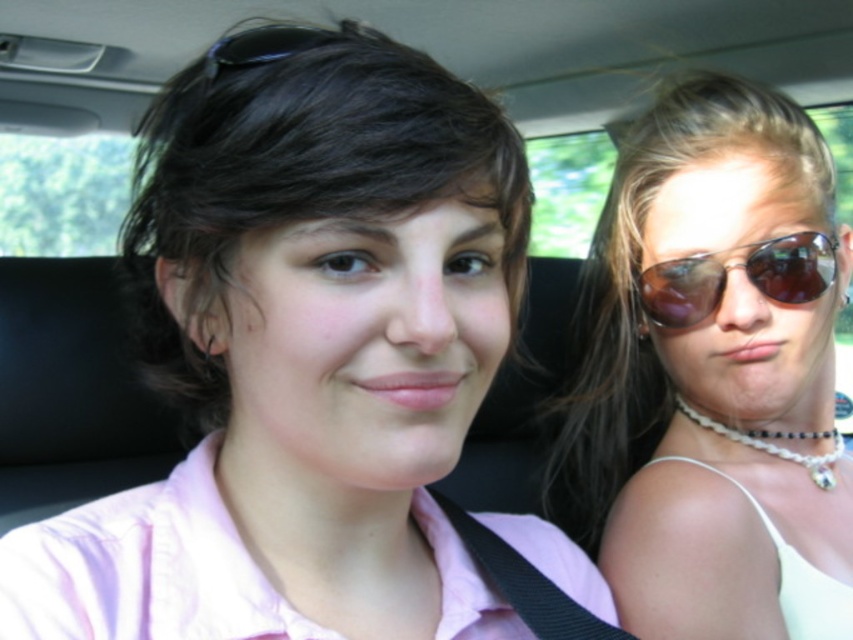
Which is above, sunglasses at right or brown reflective sunglasses at right?

brown reflective sunglasses at right

From the picture: Is sunglasses at right smaller than brown reflective sunglasses at right?

No.

The width and height of the screenshot is (853, 640). Describe the element at coordinates (709, 365) in the screenshot. I see `sunglasses at right` at that location.

Where is `sunglasses at right`? The image size is (853, 640). sunglasses at right is located at coordinates (709, 365).

Is sunglasses at right thinner than matte pink shirt at center?

No.

Does sunglasses at right have a larger size compared to matte pink shirt at center?

Yes.

This screenshot has width=853, height=640. What are the coordinates of `sunglasses at right` in the screenshot? It's located at (709, 365).

Which is above, matte pink shirt at center or brown reflective sunglasses at right?

matte pink shirt at center

Is matte pink shirt at center shorter than brown reflective sunglasses at right?

In fact, matte pink shirt at center may be taller than brown reflective sunglasses at right.

Which is in front, point (392, 52) or point (804, 292)?

Point (392, 52) is more forward.

At what (x,y) coordinates should I click in order to perform the action: click on matte pink shirt at center. Please return your answer as a coordinate pair (x, y). The height and width of the screenshot is (640, 853). Looking at the image, I should click on (299, 173).